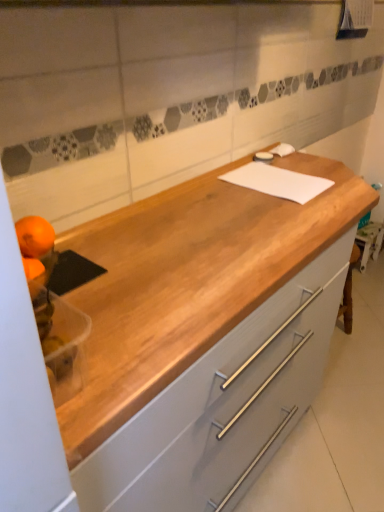
The image size is (384, 512). What do you see at coordinates (224, 405) in the screenshot?
I see `light gray wood cabinet at center` at bounding box center [224, 405].

What do you see at coordinates (278, 181) in the screenshot? The image size is (384, 512). I see `white matte cutting board at center` at bounding box center [278, 181].

Where is `light gray wood cabinet at center`? light gray wood cabinet at center is located at coordinates (224, 405).

Between orangesmoothfruit at left, which appears as the second orange when ordered from the bottom, and orange matte at left, the first orange positioned from the bottom, which one appears on the left side from the viewer's perspective?

orange matte at left, the first orange positioned from the bottom.

Does orangesmoothfruit at left, which appears as the second orange when ordered from the bottom, turn towards orange matte at left, the first orange positioned from the bottom?

No, orangesmoothfruit at left, which appears as the second orange when ordered from the bottom, is not turned towards orange matte at left, the first orange positioned from the bottom.

Considering the sizes of orangesmoothfruit at left, which is the first orange from top to bottom, and orange matte at left, marked as the 2th orange in a top-to-bottom arrangement, in the image, is orangesmoothfruit at left, which is the first orange from top to bottom, taller or shorter than orange matte at left, marked as the 2th orange in a top-to-bottom arrangement,?

Considering their sizes, orangesmoothfruit at left, which is the first orange from top to bottom, has less height than orange matte at left, marked as the 2th orange in a top-to-bottom arrangement.

Based on the photo, how distant is orangesmoothfruit at left, which is the first orange from top to bottom, from orange matte at left, marked as the 2th orange in a top-to-bottom arrangement?

orangesmoothfruit at left, which is the first orange from top to bottom, is 0.96 centimeters from orange matte at left, marked as the 2th orange in a top-to-bottom arrangement.

Is white matte cutting board at center completely or partially outside of orangesmoothfruit at left, which is the first orange from top to bottom?

Yes, white matte cutting board at center is not within orangesmoothfruit at left, which is the first orange from top to bottom.

In terms of height, does white matte cutting board at center look taller or shorter compared to orangesmoothfruit at left, which is the first orange from top to bottom?

In the image, white matte cutting board at center appears to be shorter than orangesmoothfruit at left, which is the first orange from top to bottom.

Based on the photo, measure the distance from white matte cutting board at center to orangesmoothfruit at left, which is the first orange from top to bottom.

The distance of white matte cutting board at center from orangesmoothfruit at left, which is the first orange from top to bottom, is 69.67 centimeters.

From the image's perspective, which is above, orangesmoothfruit at left, which appears as the second orange when ordered from the bottom, or white matte cutting board at center?

white matte cutting board at center is shown above in the image.

Is orangesmoothfruit at left, which appears as the second orange when ordered from the bottom, looking in the opposite direction of white matte cutting board at center?

No, orangesmoothfruit at left, which appears as the second orange when ordered from the bottom, is not facing the opposite direction of white matte cutting board at center.

Which is behind, orangesmoothfruit at left, which is the first orange from top to bottom, or white matte cutting board at center?

Positioned behind is white matte cutting board at center.

From a real-world perspective, which is physically below, orangesmoothfruit at left, which appears as the second orange when ordered from the bottom, or white matte cutting board at center?

In real-world perspective, white matte cutting board at center is lower.

Between white matte cutting board at center and light gray wood cabinet at center, which one has smaller width?

Thinner between the two is white matte cutting board at center.

Is white matte cutting board at center beside light gray wood cabinet at center?

No, white matte cutting board at center is not next to light gray wood cabinet at center.

Can you confirm if white matte cutting board at center is shorter than light gray wood cabinet at center?

Indeed, white matte cutting board at center has a lesser height compared to light gray wood cabinet at center.

Is the depth of white matte cutting board at center greater than that of light gray wood cabinet at center?

That is True.

Which is closer, (38, 219) or (33, 234)?

Point (33, 234)

What's the angular difference between orange matte at left, marked as the 2th orange in a top-to-bottom arrangement, and orangesmoothfruit at left, which appears as the second orange when ordered from the bottom,'s facing directions?

There is a 0.00366-degree angle between the facing directions of orange matte at left, marked as the 2th orange in a top-to-bottom arrangement, and orangesmoothfruit at left, which appears as the second orange when ordered from the bottom.

Is orange matte at left, the first orange positioned from the bottom, completely or partially outside of orangesmoothfruit at left, which is the first orange from top to bottom?

Yes, orange matte at left, the first orange positioned from the bottom, is outside of orangesmoothfruit at left, which is the first orange from top to bottom.

Is orange matte at left, marked as the 2th orange in a top-to-bottom arrangement, positioned with its back to orangesmoothfruit at left, which is the first orange from top to bottom?

No, orangesmoothfruit at left, which is the first orange from top to bottom, is not at the back of orange matte at left, marked as the 2th orange in a top-to-bottom arrangement.

Which of these two, light gray wood cabinet at center or orange matte at left, marked as the 2th orange in a top-to-bottom arrangement, is bigger?

light gray wood cabinet at center is bigger.

At what (x,y) coordinates should I click in order to perform the action: click on cabinetry on the right of orange matte at left, marked as the 2th orange in a top-to-bottom arrangement. Please return your answer as a coordinate pair (x, y). Looking at the image, I should click on (224, 405).

From the picture: Between light gray wood cabinet at center and orange matte at left, marked as the 2th orange in a top-to-bottom arrangement, which one appears on the left side from the viewer's perspective?

orange matte at left, marked as the 2th orange in a top-to-bottom arrangement.

This screenshot has width=384, height=512. Find the location of `cabinetry that is below the orange matte at left, marked as the 2th orange in a top-to-bottom arrangement (from the image's perspective)`. cabinetry that is below the orange matte at left, marked as the 2th orange in a top-to-bottom arrangement (from the image's perspective) is located at coordinates (224, 405).

Do you think orange matte at left, the first orange positioned from the bottom, is within light gray wood cabinet at center, or outside of it?

orange matte at left, the first orange positioned from the bottom, is spatially situated outside light gray wood cabinet at center.

Based on the photo, between orange matte at left, the first orange positioned from the bottom, and light gray wood cabinet at center, which one has smaller size?

orange matte at left, the first orange positioned from the bottom.

Is orange matte at left, marked as the 2th orange in a top-to-bottom arrangement, far from light gray wood cabinet at center?

That's not correct — orange matte at left, marked as the 2th orange in a top-to-bottom arrangement, is a little close to light gray wood cabinet at center.

Locate an element on the screen. orange below the orangesmoothfruit at left, which appears as the second orange when ordered from the bottom (from the image's perspective) is located at coordinates (37, 245).

Where is `the 1st orange in front when counting from the white matte cutting board at center`? the 1st orange in front when counting from the white matte cutting board at center is located at coordinates (35, 236).

Considering their positions, is white matte cutting board at center positioned further to orange matte at left, the first orange positioned from the bottom, than light gray wood cabinet at center?

The object further to orange matte at left, the first orange positioned from the bottom, is white matte cutting board at center.

Considering their positions, is orange matte at left, marked as the 2th orange in a top-to-bottom arrangement, positioned closer to white matte cutting board at center than light gray wood cabinet at center?

light gray wood cabinet at center lies closer to white matte cutting board at center than the other object.

Considering their positions, is orange matte at left, marked as the 2th orange in a top-to-bottom arrangement, positioned closer to light gray wood cabinet at center than orangesmoothfruit at left, which is the first orange from top to bottom?

Based on the image, orange matte at left, marked as the 2th orange in a top-to-bottom arrangement, appears to be nearer to light gray wood cabinet at center.

When comparing their distances from orange matte at left, the first orange positioned from the bottom, does light gray wood cabinet at center or white matte cutting board at center seem closer?

light gray wood cabinet at center.

Estimate the real-world distances between objects in this image. Which object is further from orange matte at left, marked as the 2th orange in a top-to-bottom arrangement, orangesmoothfruit at left, which appears as the second orange when ordered from the bottom, or light gray wood cabinet at center?

light gray wood cabinet at center is further to orange matte at left, marked as the 2th orange in a top-to-bottom arrangement.

Which object lies nearer to the anchor point white matte cutting board at center, light gray wood cabinet at center or orange matte at left, marked as the 2th orange in a top-to-bottom arrangement?

light gray wood cabinet at center is closer to white matte cutting board at center.

Estimate the real-world distances between objects in this image. Which object is closer to light gray wood cabinet at center, orange matte at left, marked as the 2th orange in a top-to-bottom arrangement, or white matte cutting board at center?

Based on the image, white matte cutting board at center appears to be nearer to light gray wood cabinet at center.

Estimate the real-world distances between objects in this image. Which object is further from orange matte at left, marked as the 2th orange in a top-to-bottom arrangement, orangesmoothfruit at left, which is the first orange from top to bottom, or white matte cutting board at center?

Based on the image, white matte cutting board at center appears to be further to orange matte at left, marked as the 2th orange in a top-to-bottom arrangement.

Locate an element on the screen. The image size is (384, 512). orange located between orange matte at left, the first orange positioned from the bottom, and light gray wood cabinet at center in the left-right direction is located at coordinates (35, 236).

Locate an element on the screen. orange between orange matte at left, marked as the 2th orange in a top-to-bottom arrangement, and white matte cutting board at center, in the horizontal direction is located at coordinates pos(35,236).

I want to click on notepad between orangesmoothfruit at left, which appears as the second orange when ordered from the bottom, and light gray wood cabinet at center, in the horizontal direction, so click(x=278, y=181).

Where is `notepad between orange matte at left, marked as the 2th orange in a top-to-bottom arrangement, and light gray wood cabinet at center, in the horizontal direction`? This screenshot has height=512, width=384. notepad between orange matte at left, marked as the 2th orange in a top-to-bottom arrangement, and light gray wood cabinet at center, in the horizontal direction is located at coordinates (278, 181).